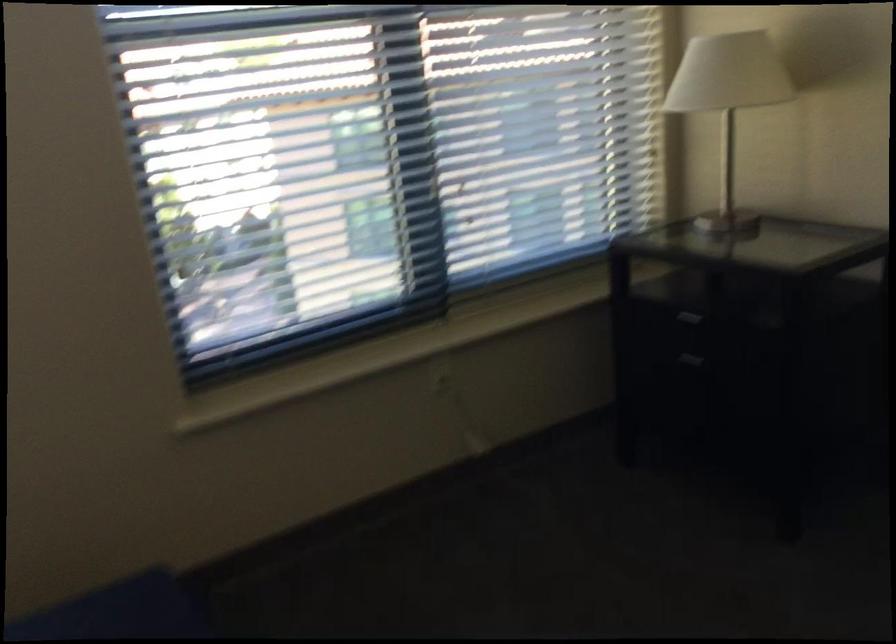
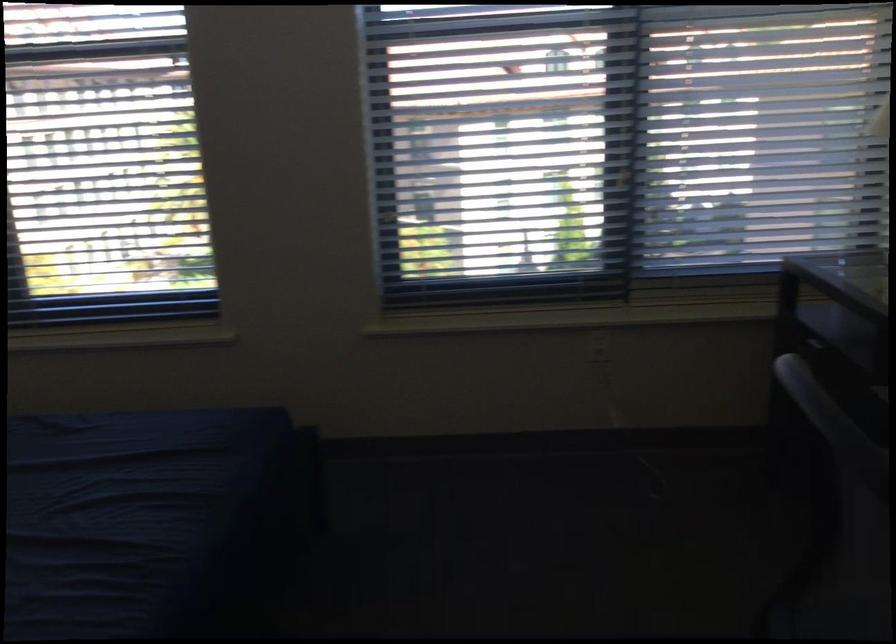
Question: The camera is either moving clockwise (left) or counter-clockwise (right) around the object. The first image is from the beginning of the video and the second image is from the end. Is the camera moving left or right when shooting the video?

Choices:
 (A) Left
 (B) Right

Answer: (B)